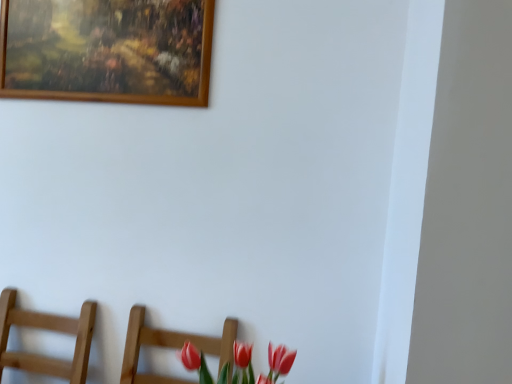
The height and width of the screenshot is (384, 512). In order to click on wooden picture frame at upper left in this screenshot , I will do `click(106, 50)`.

Measure the distance between point (56, 33) and camera.

They are 4.56 feet apart.

Image resolution: width=512 pixels, height=384 pixels. What do you see at coordinates (106, 50) in the screenshot?
I see `wooden picture frame at upper left` at bounding box center [106, 50].

You are a GUI agent. You are given a task and a screenshot of the screen. Output one action in this format:
    pyautogui.click(x=<x>, y=<y>)
    Task: Click on the wooden picture frame at upper left
    
    Given the screenshot: What is the action you would take?
    pyautogui.click(x=106, y=50)